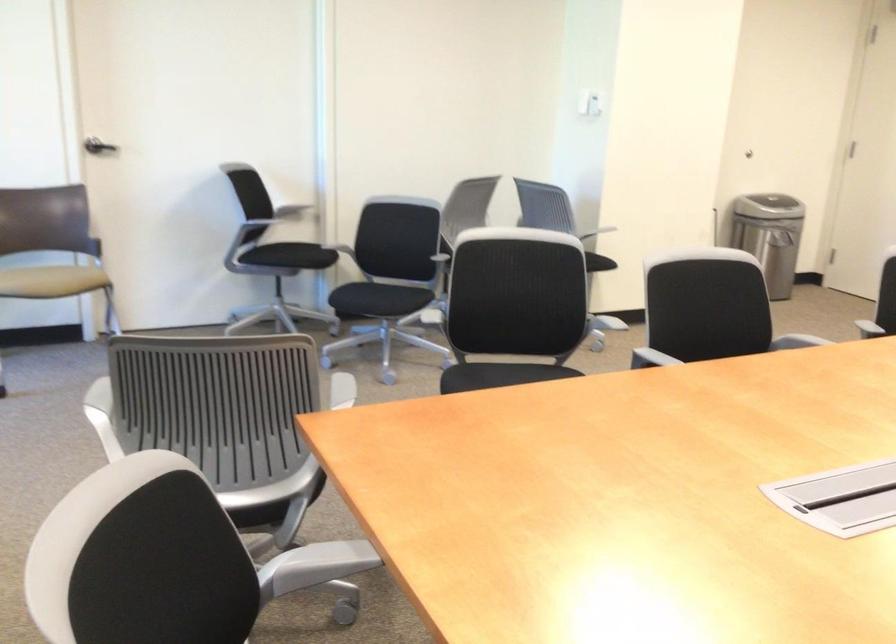
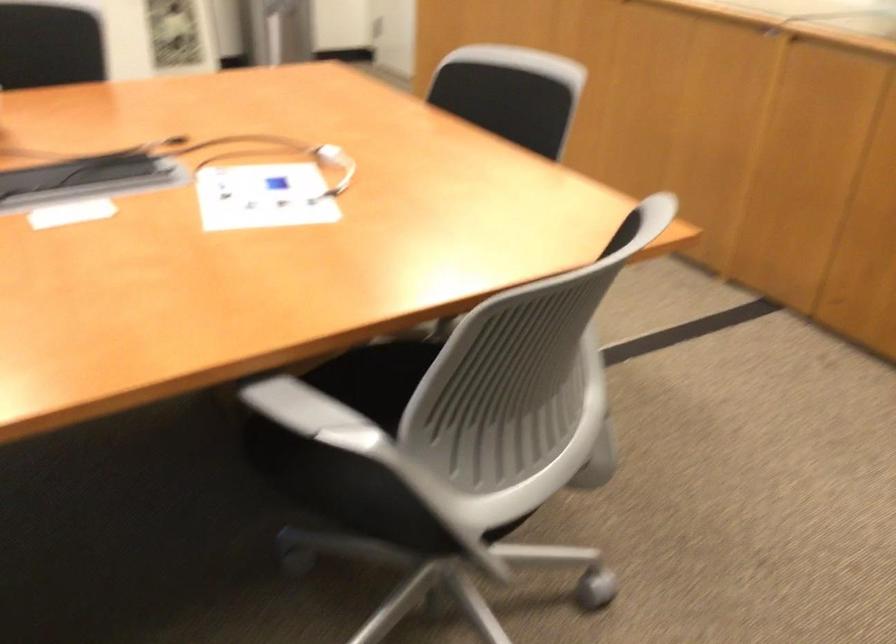
Question: The images are taken continuously from a first-person perspective. In which direction are you moving?

Choices:
 (A) Left
 (B) Right
 (C) Forward
 (D) Backward

Answer: (B)